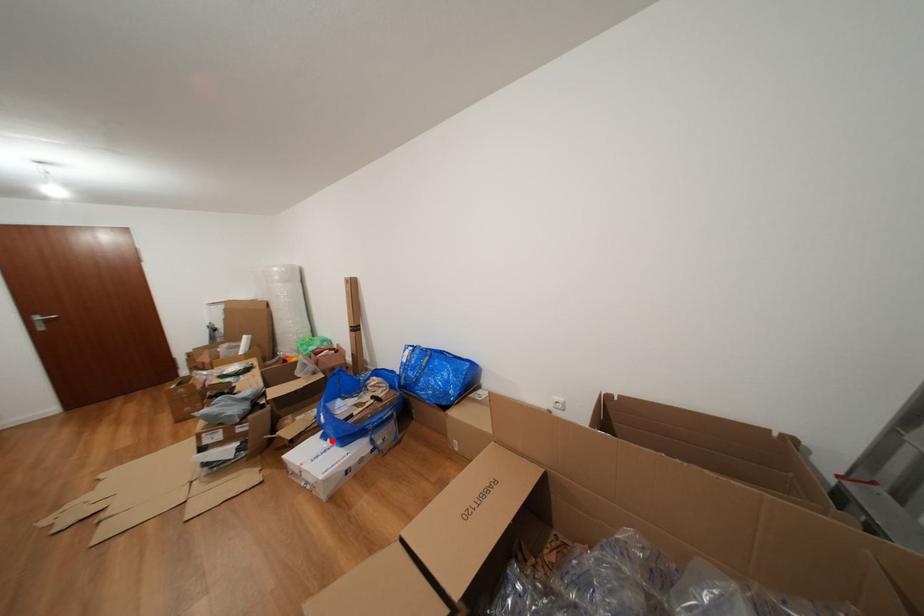
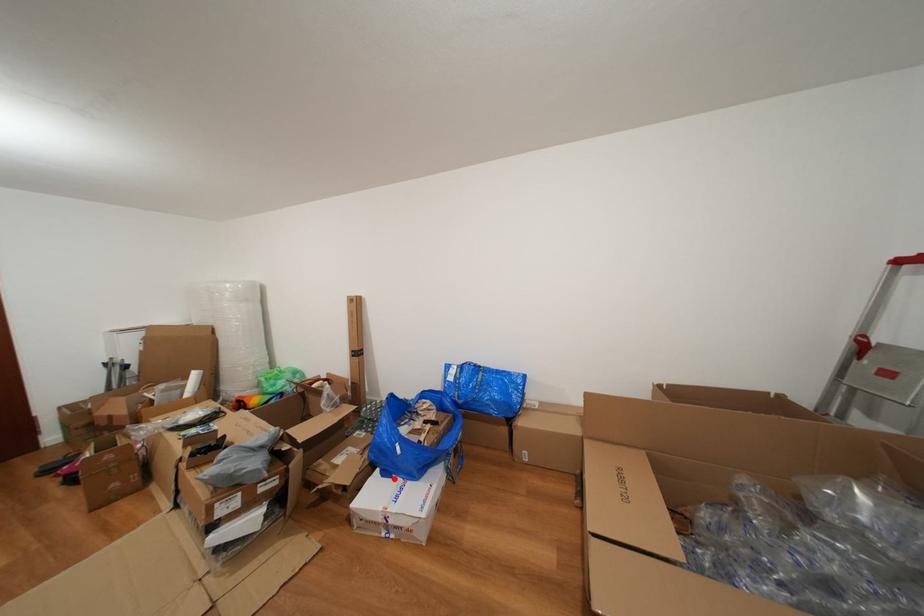
Looking at this image, I am providing you with two images of the same scene from different viewpoints. A red point is marked on the first image and another point is marked on the second image. Is the red point in image1 aligned with the point shown in image2?

Yes